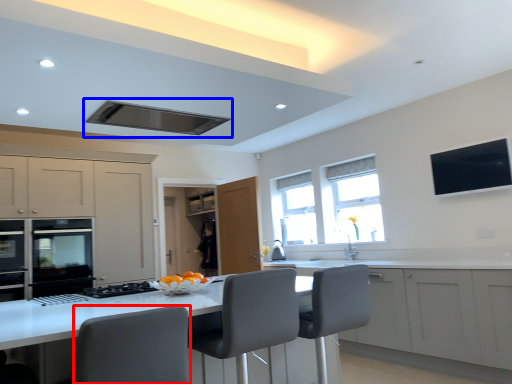
Question: Which of the following is the closest to the observer, swivel chair (highlighted by a red box) or exhaust hood (highlighted by a blue box)?

Choices:
 (A) swivel chair
 (B) exhaust hood

Answer: (A)